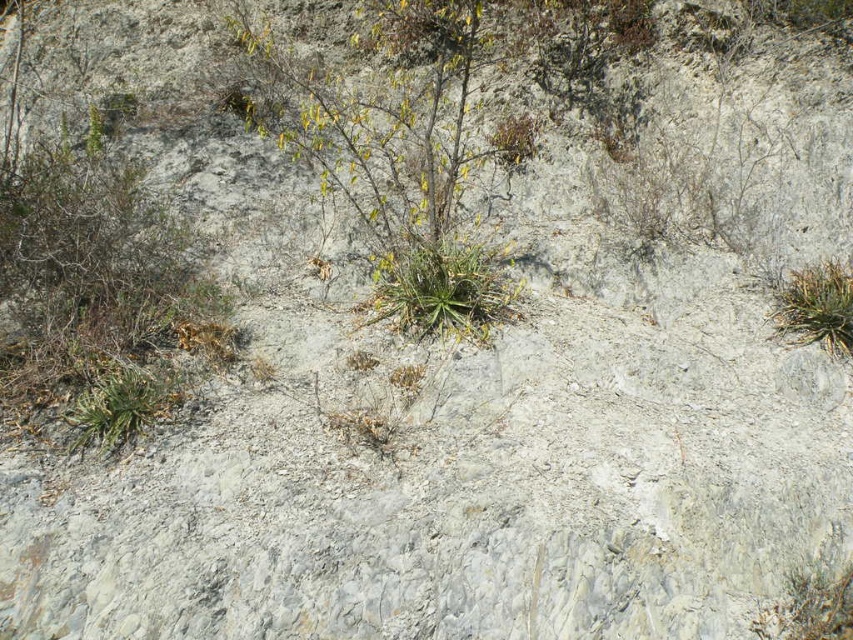
Question: Does green leafy plant at lower left have a lesser width compared to green leafy plant at lower right?

Choices:
 (A) no
 (B) yes

Answer: (A)

Question: Observing the image, what is the correct spatial positioning of green leafy plant at lower left in reference to green leafy plant at lower right?

Choices:
 (A) above
 (B) below

Answer: (B)

Question: Which object appears farthest from the camera in this image?

Choices:
 (A) green leafy plant at lower left
 (B) green leafy plant at center

Answer: (B)

Question: Which object is positioned farthest from the green leafy plant at center?

Choices:
 (A) green leafy plant at lower left
 (B) green leafy plant at lower right

Answer: (B)

Question: Estimate the real-world distances between objects in this image. Which object is closer to the green leafy plant at lower right?

Choices:
 (A) green leafy plant at lower left
 (B) green leafy plant at center

Answer: (B)

Question: Can you confirm if green leafy plant at lower left is wider than green leafy plant at lower right?

Choices:
 (A) yes
 (B) no

Answer: (A)